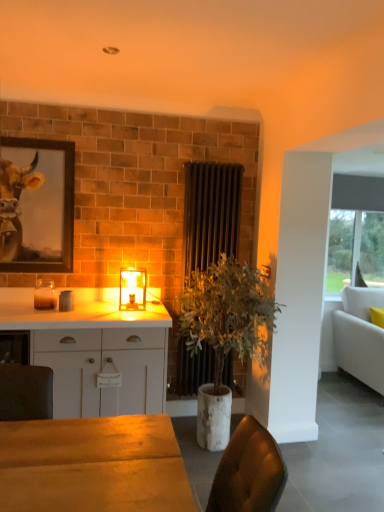
The image size is (384, 512). Describe the element at coordinates (224, 334) in the screenshot. I see `green leafy plant in concrete pot at center` at that location.

This screenshot has height=512, width=384. I want to click on translucent glass candle at left, so click(45, 295).

The image size is (384, 512). I want to click on translucent glass lamp at center, so click(132, 289).

Is white matte cabinet at center taller than black metal radiator at center?

No.

From a real-world perspective, does white matte cabinet at center sit lower than black metal radiator at center?

Yes, from a real-world perspective, white matte cabinet at center is beneath black metal radiator at center.

Based on the photo, between white matte cabinet at center and black metal radiator at center, which one has smaller size?

Smaller between the two is black metal radiator at center.

Which is closer, (47, 351) or (210, 248)?

The point (47, 351) is closer to the camera.

Could you tell me if black metal radiator at center is turned towards white matte cabinet at center?

No.

Which of these two, black metal radiator at center or white matte cabinet at center, is smaller?

With smaller size is black metal radiator at center.

Would you say black metal radiator at center is inside or outside white matte cabinet at center?

black metal radiator at center is spatially situated outside white matte cabinet at center.

Who is taller, black metal radiator at center or white matte cabinet at center?

With more height is black metal radiator at center.

Which of these two, translucent glass lamp at center or black metal radiator at center, stands taller?

black metal radiator at center is taller.

From a real-world perspective, is translucent glass lamp at center above or below black metal radiator at center?

From a real-world perspective, translucent glass lamp at center is physically below black metal radiator at center.

Does translucent glass lamp at center contain black metal radiator at center?

No, black metal radiator at center is not surrounded by translucent glass lamp at center.

Between translucent glass lamp at center and black metal radiator at center, which one is positioned in front?

Positioned in front is translucent glass lamp at center.

Is white matte cabinet at center placed right next to translucent glass lamp at center?

No, white matte cabinet at center is not in contact with translucent glass lamp at center.

Considering the sizes of objects white matte cabinet at center and translucent glass lamp at center in the image provided, who is bigger, white matte cabinet at center or translucent glass lamp at center?

Bigger between the two is white matte cabinet at center.

Considering the relative sizes of white matte cabinet at center and translucent glass lamp at center in the image provided, is white matte cabinet at center shorter than translucent glass lamp at center?

No.

From the image's perspective, does white matte cabinet at center appear lower than translucent glass lamp at center?

Yes, from the image's perspective, white matte cabinet at center is below translucent glass lamp at center.

From a real-world perspective, is translucent glass candle at left positioned over translucent glass lamp at center based on gravity?

Actually, translucent glass candle at left is physically below translucent glass lamp at center in the real world.

Considering the points (46, 283) and (144, 302), which point is behind, point (46, 283) or point (144, 302)?

The point (46, 283) is farther.

Considering the sizes of objects translucent glass candle at left and translucent glass lamp at center in the image provided, who is thinner, translucent glass candle at left or translucent glass lamp at center?

translucent glass candle at left is thinner.

From the image's perspective, is translucent glass candle at left located beneath translucent glass lamp at center?

Yes.

Is wooden framed painting at upper left not near translucent glass candle at left?

wooden framed painting at upper left is near translucent glass candle at left, not far away.

Does wooden framed painting at upper left have a lesser width compared to translucent glass candle at left?

Indeed, wooden framed painting at upper left has a lesser width compared to translucent glass candle at left.

From a real-world perspective, is wooden framed painting at upper left on translucent glass candle at left?

Yes.

Considering the sizes of objects translucent glass candle at left and black metal radiator at center in the image provided, who is taller, translucent glass candle at left or black metal radiator at center?

black metal radiator at center.

Is translucent glass candle at left not close to black metal radiator at center?

Yes.

Would you say translucent glass candle at left is inside or outside black metal radiator at center?

translucent glass candle at left is spatially situated outside black metal radiator at center.

I want to click on radiator on the right side of translucent glass candle at left, so click(210, 214).

You are a GUI agent. You are given a task and a screenshot of the screen. Output one action in this format:
    pyautogui.click(x=<x>, y=<y>)
    Task: Click on the radiator behind the white matte cabinet at center
    This screenshot has height=512, width=384.
    Given the screenshot: What is the action you would take?
    pyautogui.click(x=210, y=214)

Find the location of a particular element. radiator on the right side of white matte cabinet at center is located at coordinates (210, 214).

Which object lies further to the anchor point black metal radiator at center, white fabric couch at right or green leafy plant in concrete pot at center?

Based on the image, white fabric couch at right appears to be further to black metal radiator at center.

Which object lies further to the anchor point translucent glass candle at left, white fabric couch at right or white matte cabinet at center?

white fabric couch at right.

When comparing their distances from black metal radiator at center, does white matte cabinet at center or green leafy plant in concrete pot at center seem further?

Among the two, white matte cabinet at center is located further to black metal radiator at center.

Based on their spatial positions, is wooden framed painting at upper left or white matte cabinet at center further from white fabric couch at right?

wooden framed painting at upper left is further to white fabric couch at right.

Estimate the real-world distances between objects in this image. Which object is closer to white matte cabinet at center, white fabric couch at right or black metal radiator at center?

Among the two, black metal radiator at center is located nearer to white matte cabinet at center.

Estimate the real-world distances between objects in this image. Which object is further from green leafy plant in concrete pot at center, translucent glass candle at left or black metal radiator at center?

Among the two, translucent glass candle at left is located further to green leafy plant in concrete pot at center.

Considering their positions, is black metal radiator at center positioned closer to wooden framed painting at upper left than white fabric couch at right?

The object closer to wooden framed painting at upper left is black metal radiator at center.

When comparing their distances from black metal radiator at center, does white matte cabinet at center or wooden framed painting at upper left seem further?

Based on the image, wooden framed painting at upper left appears to be further to black metal radiator at center.

Identify the location of lamp between wooden framed painting at upper left and black metal radiator at center. (132, 289).

Where is `candle holder situated between wooden framed painting at upper left and translucent glass lamp at center from left to right`? The width and height of the screenshot is (384, 512). candle holder situated between wooden framed painting at upper left and translucent glass lamp at center from left to right is located at coordinates (45, 295).

This screenshot has height=512, width=384. I want to click on candle holder between wooden framed painting at upper left and white fabric couch at right from left to right, so click(x=45, y=295).

Find the location of a particular element. houseplant between white matte cabinet at center and white fabric couch at right in the horizontal direction is located at coordinates (224, 334).